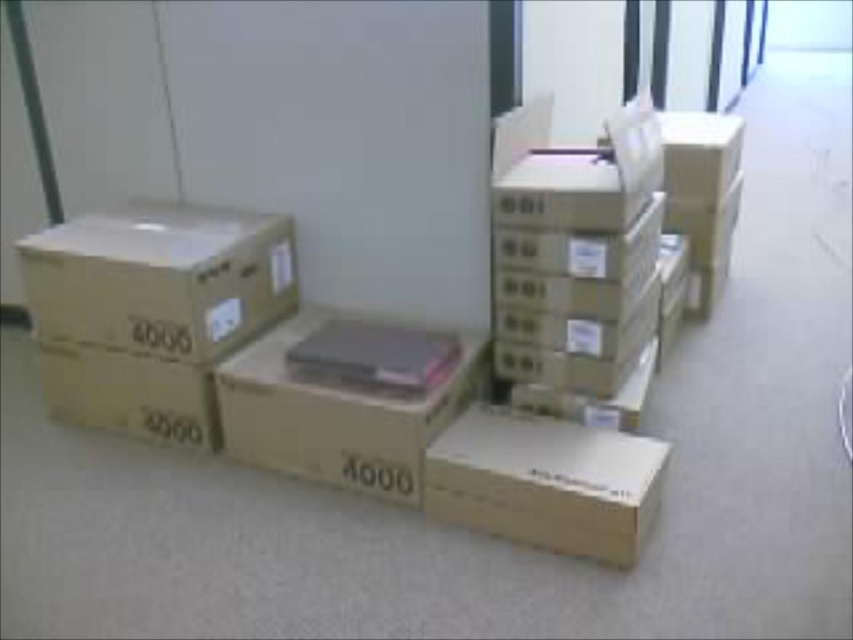
Is point (54, 316) positioned before point (497, 428)?

No, (54, 316) is behind (497, 428).

Who is lower down, brown cardboard box at left or brown cardboard box at lower center?

brown cardboard box at lower center

What are the coordinates of `brown cardboard box at left` in the screenshot? It's located at (160, 278).

At what (x,y) coordinates should I click in order to perform the action: click on brown cardboard box at left. Please return your answer as a coordinate pair (x, y). The height and width of the screenshot is (640, 853). Looking at the image, I should click on (160, 278).

What do you see at coordinates (546, 483) in the screenshot? The image size is (853, 640). I see `brown cardboard box at lower center` at bounding box center [546, 483].

Measure the distance from brown cardboard box at lower center to brown cardboard box at center.

A distance of 12.54 inches exists between brown cardboard box at lower center and brown cardboard box at center.

Which is in front, point (611, 540) or point (312, 436)?

Positioned in front is point (611, 540).

Identify the location of brown cardboard box at lower center. This screenshot has height=640, width=853. (546, 483).

Is brown cardboard box at left to the left of brown cardboard box at center from the viewer's perspective?

Yes, brown cardboard box at left is to the left of brown cardboard box at center.

Between point (128, 337) and point (473, 376), which one is positioned in front?

Positioned in front is point (473, 376).

Locate an element on the screen. Image resolution: width=853 pixels, height=640 pixels. brown cardboard box at left is located at coordinates (160, 278).